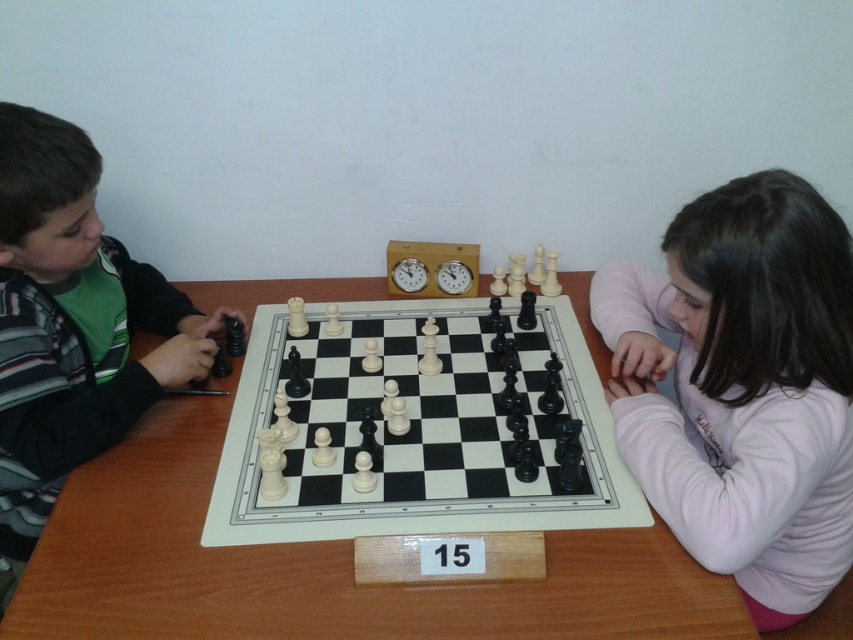
Question: Which object is farther from the camera taking this photo?

Choices:
 (A) striped fleece jacket at left
 (B) white plastic chess pieces at center
 (C) white wooden table at center

Answer: (B)

Question: Is white wooden table at center closer to camera compared to light pink fleece at right?

Choices:
 (A) no
 (B) yes

Answer: (B)

Question: Is white wooden table at center positioned before striped fleece jacket at left?

Choices:
 (A) no
 (B) yes

Answer: (B)

Question: Which object is farther from the camera taking this photo?

Choices:
 (A) white wooden table at center
 (B) striped fleece jacket at left
 (C) light pink fleece at right
 (D) white plastic chess pieces at center

Answer: (D)

Question: Which point is farther to the camera?

Choices:
 (A) (73, 200)
 (B) (604, 600)
 (C) (654, 428)

Answer: (C)

Question: Does white wooden table at center have a greater width compared to light pink fleece at right?

Choices:
 (A) no
 (B) yes

Answer: (B)